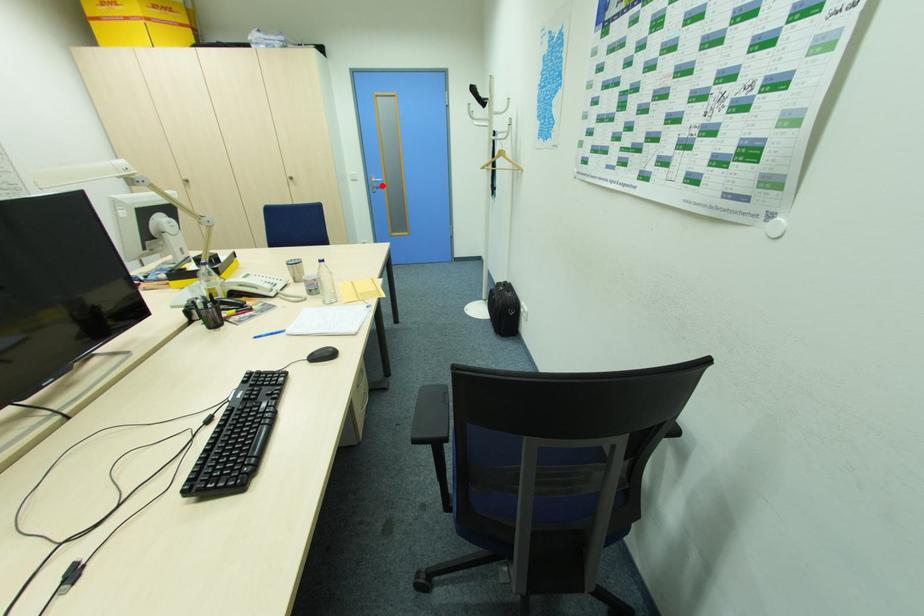
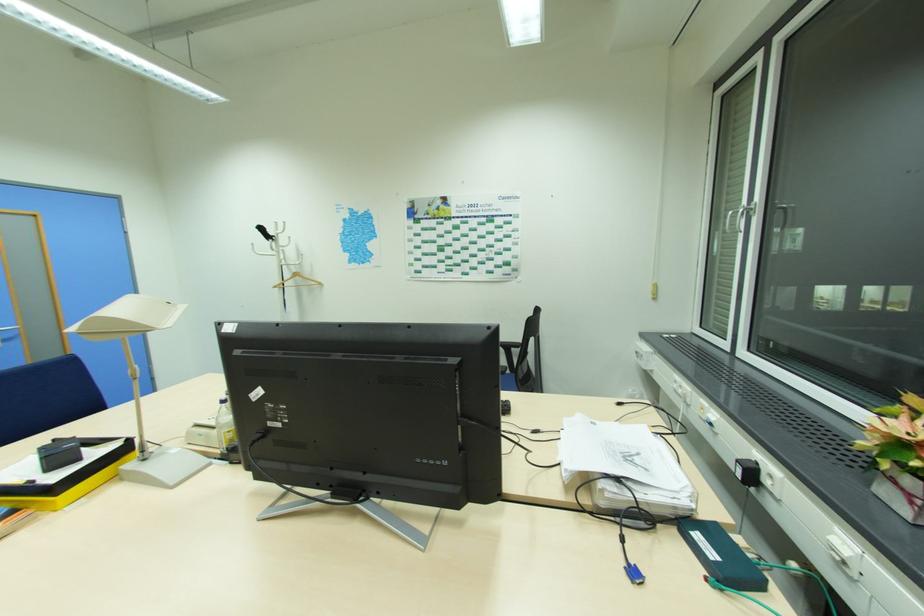
Question: I am providing you with two images of the same scene from different viewpoints. In image1, a red point is highlighted. Considering the same 3D point in image2, which of the following is correct?

Choices:
 (A) It is closer
 (B) It is farther

Answer: (B)